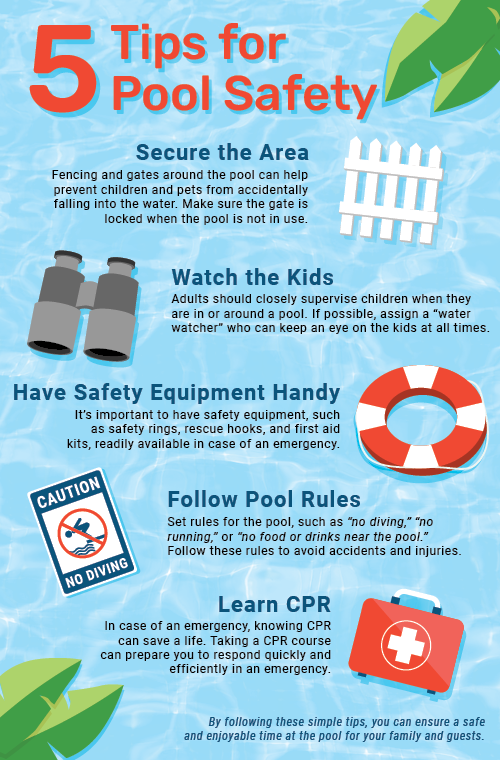
The height and width of the screenshot is (760, 500). Identify the location of box. (436, 660).